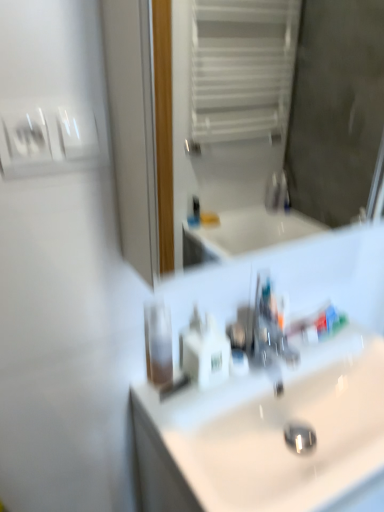
Question: Is the depth of white glossy toothpaste at center less than that of white glossy light switch at upper left?

Choices:
 (A) yes
 (B) no

Answer: (B)

Question: Does white glossy toothpaste at center have a larger size compared to white glossy light switch at upper left?

Choices:
 (A) yes
 (B) no

Answer: (A)

Question: Is white glossy toothpaste at center oriented away from white glossy light switch at upper left?

Choices:
 (A) yes
 (B) no

Answer: (B)

Question: Considering the relative sizes of white glossy toothpaste at center and white glossy light switch at upper left in the image provided, is white glossy toothpaste at center wider than white glossy light switch at upper left?

Choices:
 (A) yes
 (B) no

Answer: (A)

Question: Does white glossy toothpaste at center have a greater height compared to white glossy light switch at upper left?

Choices:
 (A) yes
 (B) no

Answer: (B)

Question: Which is correct: white plastic soap dispenser at center is inside white glossy sink at center, or outside of it?

Choices:
 (A) outside
 (B) inside

Answer: (A)

Question: Considering the positions of white plastic soap dispenser at center and white glossy sink at center in the image, is white plastic soap dispenser at center wider or thinner than white glossy sink at center?

Choices:
 (A) wide
 (B) thin

Answer: (B)

Question: Does point (208, 321) appear closer or farther from the camera than point (193, 413)?

Choices:
 (A) farther
 (B) closer

Answer: (A)

Question: From a real-world perspective, is white plastic soap dispenser at center above or below white glossy sink at center?

Choices:
 (A) below
 (B) above

Answer: (B)

Question: Is point (269, 441) positioned closer to the camera than point (185, 354)?

Choices:
 (A) farther
 (B) closer

Answer: (B)

Question: Is white glossy sink at center wider or thinner than white plastic soap dispenser at center?

Choices:
 (A) wide
 (B) thin

Answer: (A)

Question: Considering the positions of white glossy sink at center and white plastic soap dispenser at center in the image, is white glossy sink at center bigger or smaller than white plastic soap dispenser at center?

Choices:
 (A) big
 (B) small

Answer: (A)

Question: From the image's perspective, is white glossy sink at center positioned above or below white plastic soap dispenser at center?

Choices:
 (A) above
 (B) below

Answer: (B)

Question: Is point (157, 354) positioned closer to the camera than point (170, 101)?

Choices:
 (A) closer
 (B) farther

Answer: (A)

Question: Considering their positions, is transparent plastic mouthwash at center located in front of or behind white glossy mirror at upper center?

Choices:
 (A) front
 (B) behind

Answer: (B)